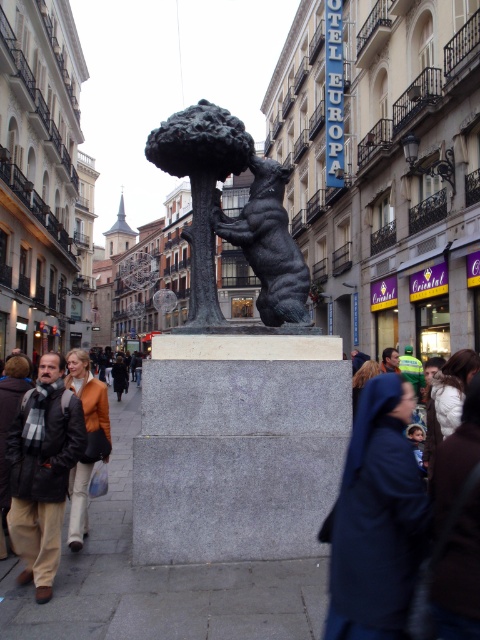
You are a photographer standing in the bustling urban scene. You notice the orange leather jacket at lower left and the dark brown hair at center. Which object is positioned lower in the image?

The orange leather jacket at lower left is located below dark brown hair at center, so the orange leather jacket at lower left is positioned lower in the image.

You are a tourist standing in the middle of the street looking at the statue. You notice the bronze bear at center and the dark brown hair at center. Which object is positioned to the right from your perspective?

The dark brown hair at center is positioned to the right of the bronze bear at center.

You are a tourist standing at the base of the polished bronze bear at center. You want to go to the Hotel Europa. Which direction should you walk to reach the Hotel Europa?

The Hotel Europa is to the right of the polished bronze bear at center, so you should walk to the right to reach it.